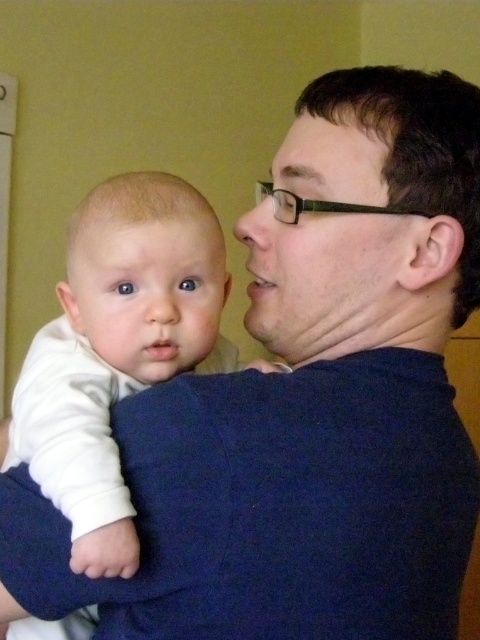
Measure the distance from white soft baby at left to matte black face at center.

white soft baby at left and matte black face at center are 13.98 centimeters apart.

Does white soft baby at left appear on the left side of matte black face at center?

Correct, you'll find white soft baby at left to the left of matte black face at center.

The width and height of the screenshot is (480, 640). I want to click on white soft baby at left, so click(x=118, y=349).

Which is behind, point (355, 278) or point (159, 360)?

Point (159, 360)

Can you confirm if matte black face at center is smaller than smooth white baby at center?

Actually, matte black face at center might be larger than smooth white baby at center.

Between point (383, 221) and point (99, 243), which one is positioned in front?

Point (383, 221) is more forward.

At what (x,y) coordinates should I click in order to perform the action: click on matte black face at center. Please return your answer as a coordinate pair (x, y). Looking at the image, I should click on click(324, 282).

Who is more forward, (100,321) or (186,332)?

Positioned in front is point (186,332).

Which of these two, white soft baby at left or smooth white baby at center, stands shorter?

smooth white baby at center is shorter.

Describe the element at coordinates (118, 349) in the screenshot. I see `white soft baby at left` at that location.

The image size is (480, 640). I want to click on white soft baby at left, so click(x=118, y=349).